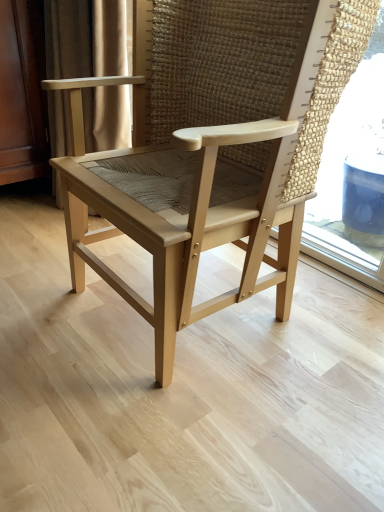
Question: Is natural wood chair at center to the right of satin gold curtain at left from the viewer's perspective?

Choices:
 (A) no
 (B) yes

Answer: (B)

Question: Is natural wood chair at center wider than satin gold curtain at left?

Choices:
 (A) yes
 (B) no

Answer: (A)

Question: Could you tell me if natural wood chair at center is facing satin gold curtain at left?

Choices:
 (A) yes
 (B) no

Answer: (B)

Question: From a real-world perspective, is natural wood chair at center on top of satin gold curtain at left?

Choices:
 (A) no
 (B) yes

Answer: (B)

Question: Is natural wood chair at center far from satin gold curtain at left?

Choices:
 (A) yes
 (B) no

Answer: (B)

Question: From the image's perspective, is natural wood chair at center below satin gold curtain at left?

Choices:
 (A) no
 (B) yes

Answer: (B)

Question: Can you confirm if satin gold curtain at left is shorter than natural wood chair at center?

Choices:
 (A) no
 (B) yes

Answer: (A)

Question: Is satin gold curtain at left not inside natural wood chair at center?

Choices:
 (A) yes
 (B) no

Answer: (A)

Question: Is satin gold curtain at left looking in the opposite direction of natural wood chair at center?

Choices:
 (A) no
 (B) yes

Answer: (A)

Question: Is satin gold curtain at left far from natural wood chair at center?

Choices:
 (A) yes
 (B) no

Answer: (B)

Question: Considering the relative sizes of satin gold curtain at left and natural wood chair at center in the image provided, is satin gold curtain at left thinner than natural wood chair at center?

Choices:
 (A) yes
 (B) no

Answer: (A)

Question: From a real-world perspective, is satin gold curtain at left physically above natural wood chair at center?

Choices:
 (A) yes
 (B) no

Answer: (B)

Question: In the image, is natural wood chair at center positioned in front of or behind satin gold curtain at left?

Choices:
 (A) front
 (B) behind

Answer: (A)